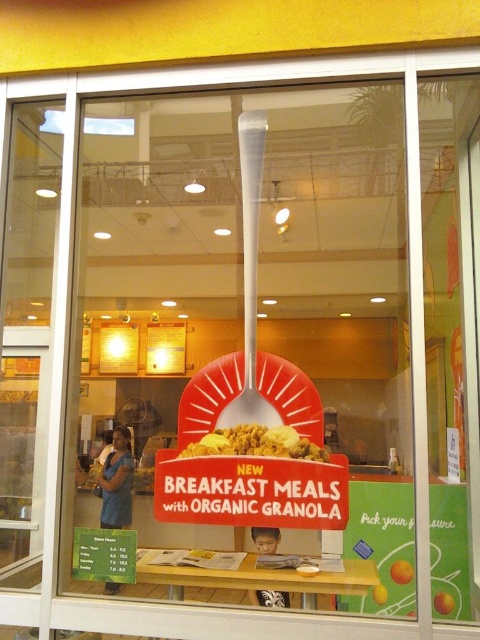
You are a customer at the breakfast restaurant and want to grab the white plastic shovel at center to serve yourself some granola. However, there is a yellow matte cereal bowl at center in the way. Can you reach the shovel without moving the bowl?

The white plastic shovel at center is located above the yellow matte cereal bowl at center, so you can reach the shovel without moving the bowl by accessing it from above.